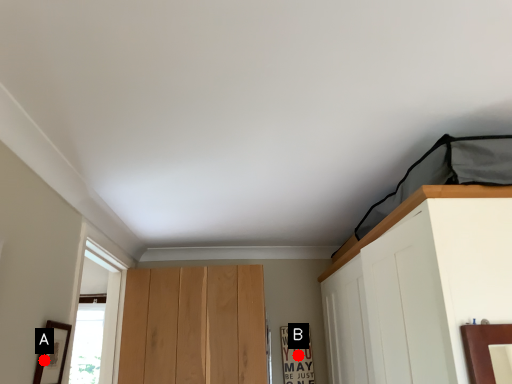
Question: Two points are circled on the image, labeled by A and B beside each circle. Among these points, which one is farthest from the camera?

Choices:
 (A) A is further
 (B) B is further

Answer: (B)